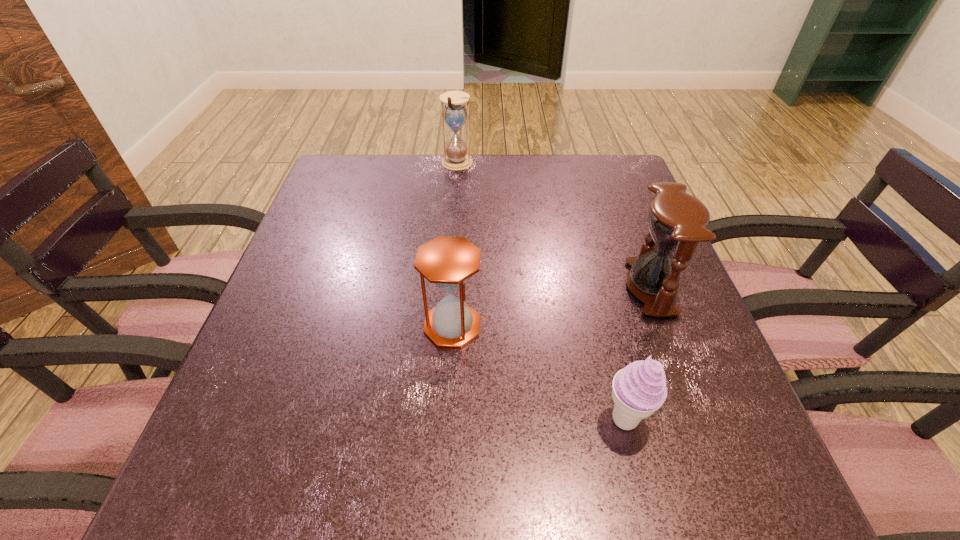
Find the location of a particular element. The width and height of the screenshot is (960, 540). the farthest object is located at coordinates (455, 158).

Where is `the rightmost object`? The image size is (960, 540). the rightmost object is located at coordinates (677, 221).

The height and width of the screenshot is (540, 960). I want to click on the shortest hourglass, so click(x=448, y=262).

The height and width of the screenshot is (540, 960). Find the location of `the nearest object`. the nearest object is located at coordinates (639, 389).

I want to click on the second object from right to left, so click(x=639, y=389).

At what (x,y) coordinates should I click in order to perform the action: click on blank area located on the right of the farthest hourglass. Please return your answer as a coordinate pair (x, y). Looking at the image, I should click on (598, 164).

I want to click on vacant point located on the left of the rightmost hourglass, so click(544, 287).

Image resolution: width=960 pixels, height=540 pixels. Identify the location of vacant position located 0.070m on the left of the shortest hourglass. (388, 325).

Where is `vacant space located on the left of the second object from right to left`? The image size is (960, 540). vacant space located on the left of the second object from right to left is located at coordinates (502, 420).

This screenshot has height=540, width=960. I want to click on object present at the far edge, so click(455, 158).